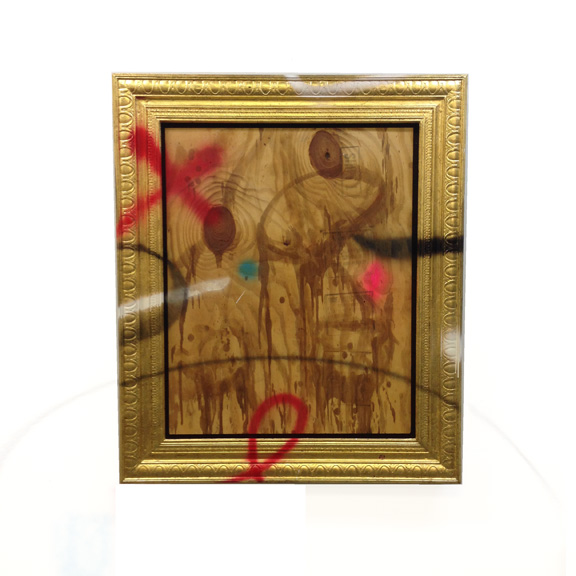
Where is `red paint on golden frame`? red paint on golden frame is located at coordinates (144, 150), (139, 204), (252, 468).